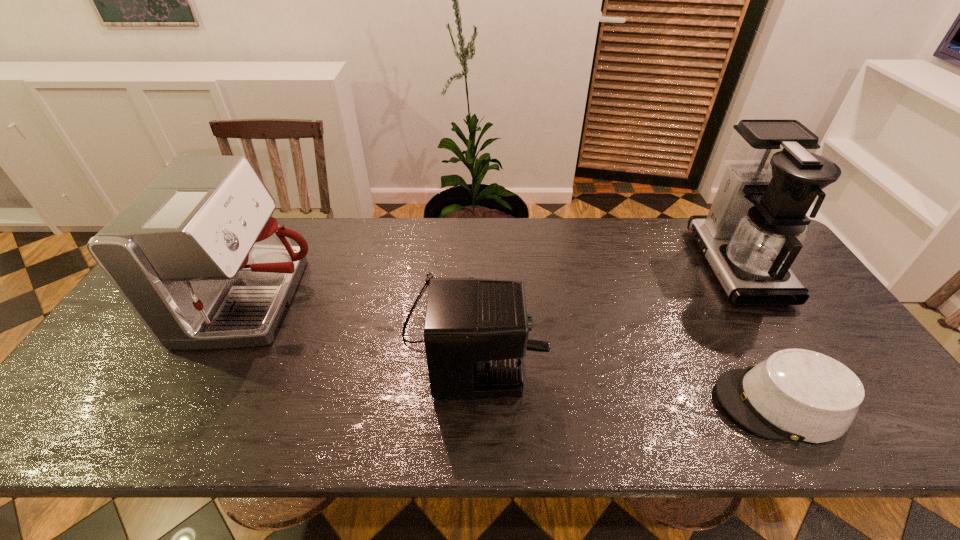
The width and height of the screenshot is (960, 540). I want to click on vacant space located on the front-facing side of the shortest object, so click(576, 403).

The height and width of the screenshot is (540, 960). What are the coordinates of `vacant space situated 0.110m on the front-facing side of the shortest object` in the screenshot? It's located at (667, 403).

Image resolution: width=960 pixels, height=540 pixels. Identify the location of blank space located 0.370m on the front-facing side of the shortest object. (554, 403).

This screenshot has height=540, width=960. I want to click on object at the near edge, so click(800, 395).

Find the location of a particular element. object that is at the left edge is located at coordinates (197, 255).

The width and height of the screenshot is (960, 540). I want to click on coffee maker that is at the right edge, so click(756, 225).

Identify the location of hat that is at the right edge. (800, 395).

The image size is (960, 540). In order to click on object located at the far left corner in this screenshot , I will do `click(197, 255)`.

Find the location of a particular element. object situated at the far right corner is located at coordinates (756, 225).

Where is `object positioned at the near right corner`? The height and width of the screenshot is (540, 960). object positioned at the near right corner is located at coordinates (800, 395).